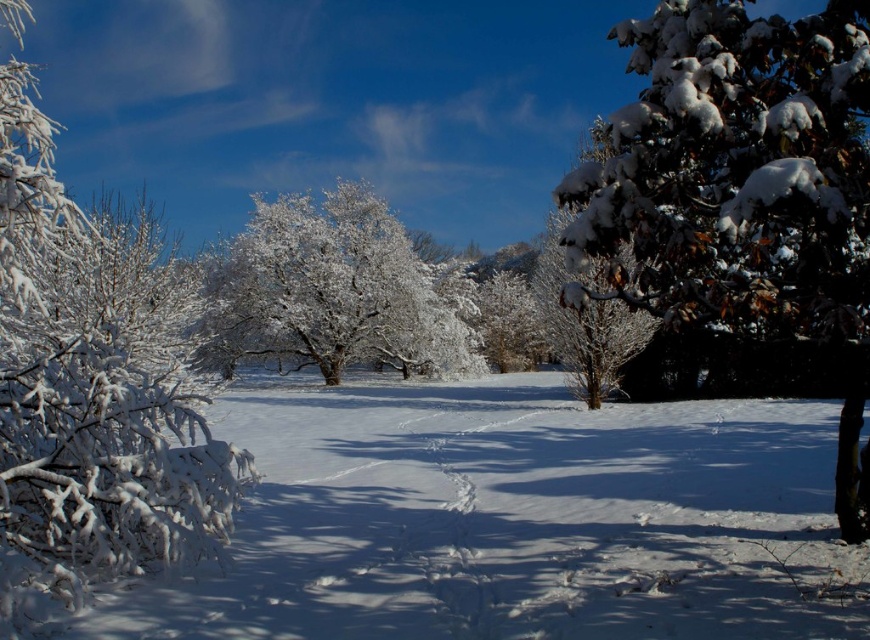
Question: Which point appears farthest from the camera in this image?

Choices:
 (A) (104, 212)
 (B) (862, 547)
 (C) (746, 45)

Answer: (A)

Question: Can you confirm if snow-covered tree at center-right is positioned above white frosty bush at center?

Choices:
 (A) no
 (B) yes

Answer: (B)

Question: Which of these objects is positioned farthest from the white frosty branches at left?

Choices:
 (A) white frosty tree at center
 (B) white frosty bush at center
 (C) white fluffy snow at lower left
 (D) snow-covered tree at right

Answer: (B)

Question: From the image, what is the correct spatial relationship of snow-covered tree at right in relation to white frosty tree at center?

Choices:
 (A) above
 (B) below

Answer: (A)

Question: Does white frosty branches at left have a lesser width compared to white frosty tree at center?

Choices:
 (A) no
 (B) yes

Answer: (A)

Question: Which point is closer to the camera?

Choices:
 (A) white frosty tree at center
 (B) white frosty branches at left
 (C) white fluffy snow at lower left

Answer: (B)